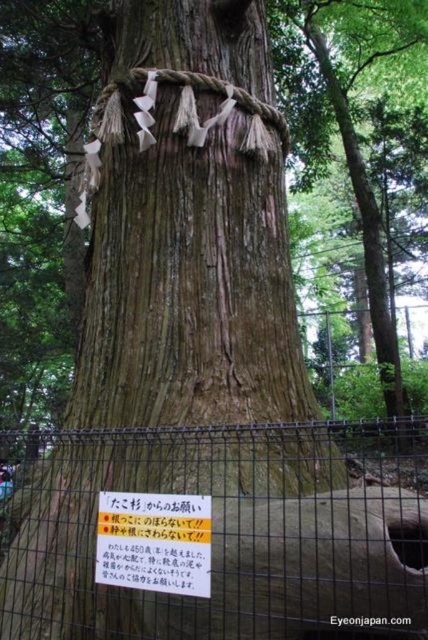
From the picture: You are standing in front of the ancient tree and notice a point marked at coordinates (216, 532). Based on the scene description, where is this point located?

The point at (216, 532) is located on the metal wire fence at lower center.

You are a visitor at a Shinto shrine and want to place a small offering on the ground near the tree. The offering is 30 cm in width. The metal wire fence at lower center and the yellow paper sign at center are in your way. Which object do you need to move to make space for your offering?

The metal wire fence at lower center is larger than the yellow paper sign at center, so you should move the metal wire fence at lower center to make space for the offering since it takes up more area.

You are a visitor at a Shinto shrine and see the metal wire fence at lower center and the yellow paper sign at center. According to their positions, which object is more to the right?

The metal wire fence at lower center is positioned on the right side of yellow paper sign at center, so it is more to the right.